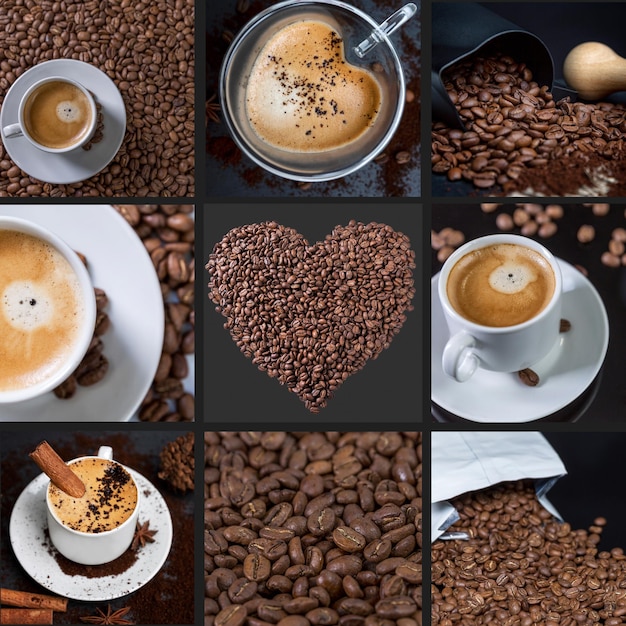
At what (x,y) coordinates should I click in order to perform the action: click on saucers. Please return your answer as a coordinate pair (x, y). The height and width of the screenshot is (626, 626). Looking at the image, I should click on (468, 402), (125, 361), (111, 593), (121, 123).